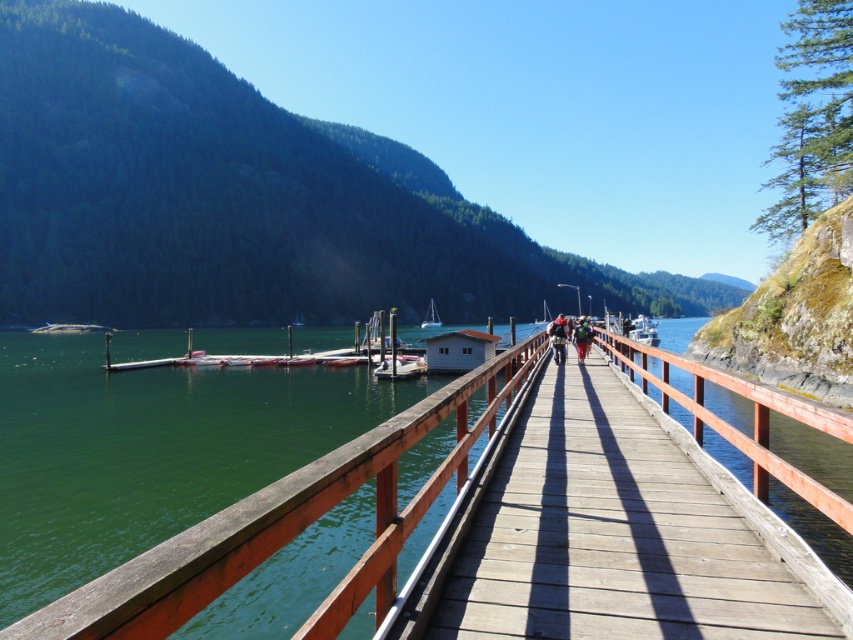
Question: From the image, what is the correct spatial relationship of wooden bridge at center in relation to white matte boat at center?

Choices:
 (A) below
 (B) above

Answer: (B)

Question: Among these objects, which one is nearest to the camera?

Choices:
 (A) white matte boat at center
 (B) green fabric jacket at center
 (C) white glossy sailboat at center
 (D) wooden bridge at center

Answer: (D)

Question: Is white matte boat at center below matte black backpack at center?

Choices:
 (A) no
 (B) yes

Answer: (B)

Question: Can you confirm if green forested mountain at upper left is wider than matte black backpack at center?

Choices:
 (A) yes
 (B) no

Answer: (A)

Question: Which object appears farthest from the camera in this image?

Choices:
 (A) white glossy sailboat at center
 (B) green fabric jacket at center
 (C) matte black backpack at center

Answer: (A)

Question: Considering the real-world distances, which object is farthest from the white glossy sailboat at center?

Choices:
 (A) matte black backpack at center
 (B) white matte boat at center
 (C) wooden bridge at center

Answer: (A)